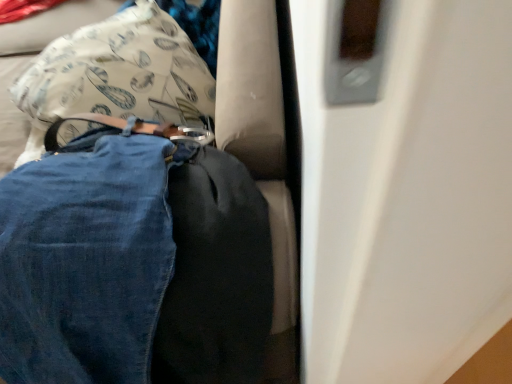
Question: Looking at the image, does white fabric pillow at center seem bigger or smaller compared to denim at left?

Choices:
 (A) big
 (B) small

Answer: (B)

Question: Relative to denim at left, is white fabric pillow at center in front or behind?

Choices:
 (A) behind
 (B) front

Answer: (A)

Question: Considering the positions of point (165, 97) and point (68, 201), is point (165, 97) closer or farther from the camera than point (68, 201)?

Choices:
 (A) closer
 (B) farther

Answer: (B)

Question: Is denim at left inside the boundaries of white fabric pillow at center, or outside?

Choices:
 (A) inside
 (B) outside

Answer: (B)

Question: Is denim at left wider or thinner than white fabric pillow at center?

Choices:
 (A) thin
 (B) wide

Answer: (B)

Question: From a real-world perspective, relative to white fabric pillow at center, is denim at left vertically above or below?

Choices:
 (A) below
 (B) above

Answer: (B)

Question: Considering the positions of denim at left and white fabric pillow at center in the image, is denim at left taller or shorter than white fabric pillow at center?

Choices:
 (A) tall
 (B) short

Answer: (A)